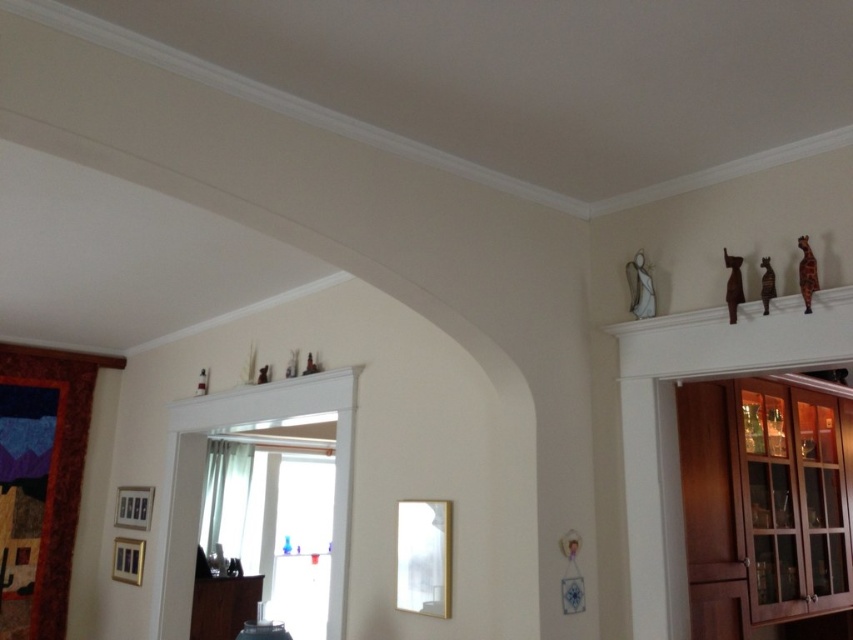
Who is more distant from viewer, (689, 532) or (239, 595)?

Positioned behind is point (239, 595).

Locate an element on the screen. brown wooden cabinet at right is located at coordinates (764, 502).